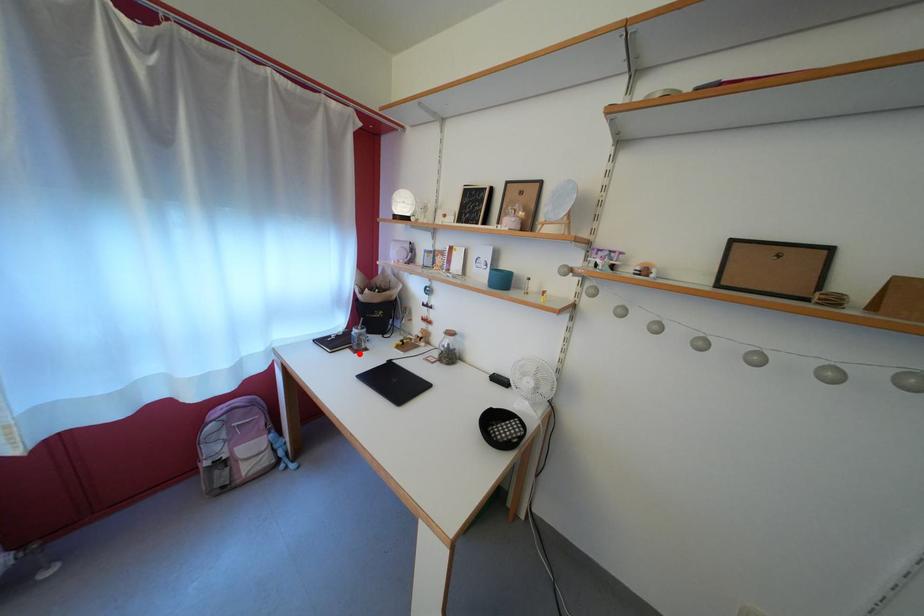
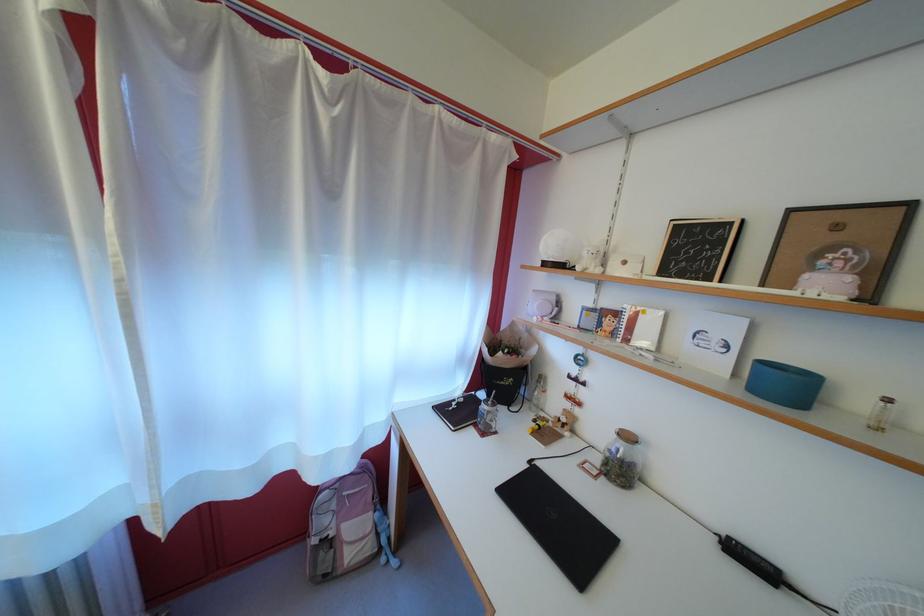
Find the pixel in the second image that matches the highlighted location in the first image.

(483, 431)